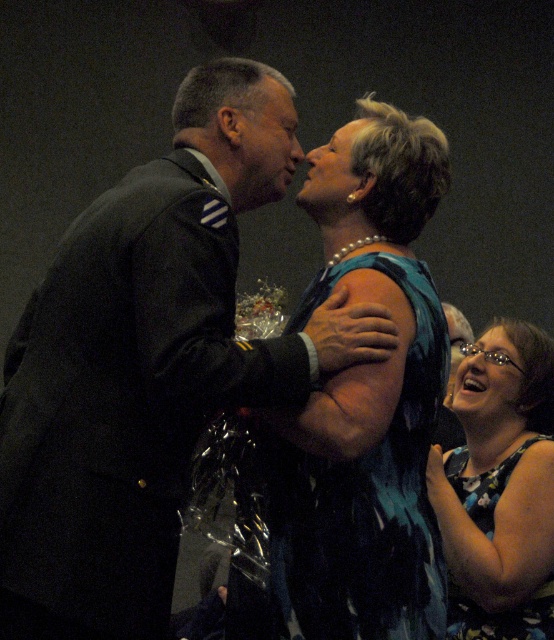
Question: Which object is closer to the camera taking this photo?

Choices:
 (A) blue satin dress at center
 (B) dark gray suit at center
 (C) pearl necklace at upper center
 (D) matte black face at center

Answer: (B)

Question: Which object is the closest to the pearl necklace at upper center?

Choices:
 (A) dark gray suit at center
 (B) floral dress at lower right

Answer: (A)

Question: Does dark gray suit at center have a larger size compared to glossy black hair at lower right?

Choices:
 (A) no
 (B) yes

Answer: (B)

Question: Does dark gray suit at center lie behind matte black face at center?

Choices:
 (A) yes
 (B) no

Answer: (B)

Question: Can you confirm if blue satin dress at center is positioned to the left of pearl necklace at upper center?

Choices:
 (A) no
 (B) yes

Answer: (B)

Question: Among these points, which one is nearest to the camera?

Choices:
 (A) (8, 580)
 (B) (280, 621)

Answer: (A)